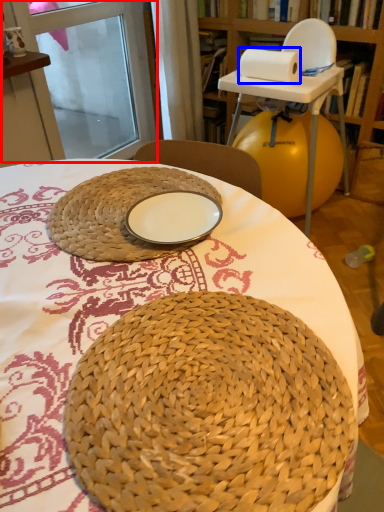
Question: Which point is closer to the camera, screen door (highlighted by a red box) or paper towel (highlighted by a blue box)?

Choices:
 (A) screen door
 (B) paper towel

Answer: (B)